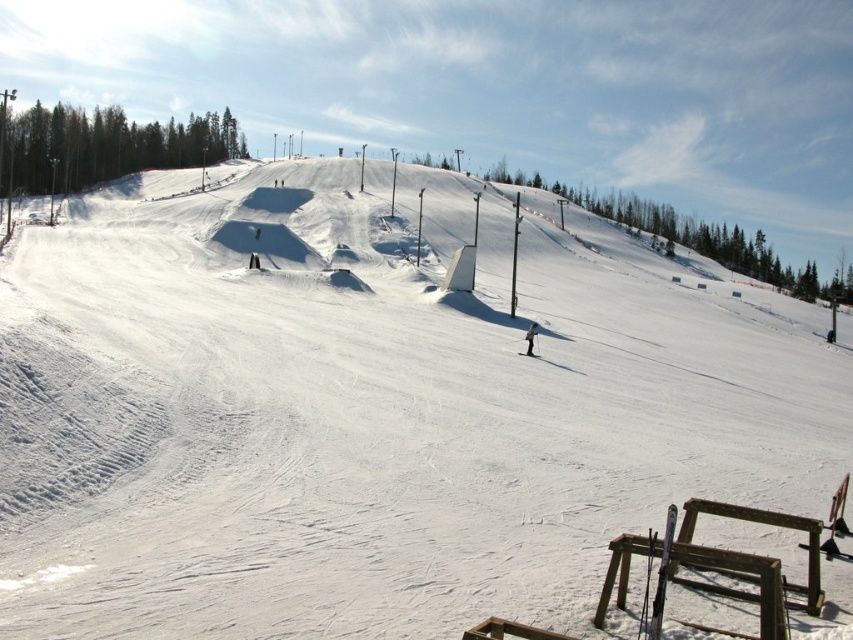
Question: Which point is closer to the camera?

Choices:
 (A) coord(534,339)
 (B) coord(671,515)

Answer: (B)

Question: Is matte black ski at lower right to the left of black matte skier at center from the viewer's perspective?

Choices:
 (A) yes
 (B) no

Answer: (A)

Question: Is matte black ski at lower right thinner than black matte skier at center?

Choices:
 (A) yes
 (B) no

Answer: (B)

Question: Which point is farther to the camera?

Choices:
 (A) black matte skier at center
 (B) matte black ski at lower right

Answer: (A)

Question: Which of the following is the closest to the observer?

Choices:
 (A) (531, 336)
 (B) (670, 516)

Answer: (B)

Question: Does matte black ski at lower right have a lesser width compared to black matte skier at center?

Choices:
 (A) no
 (B) yes

Answer: (A)